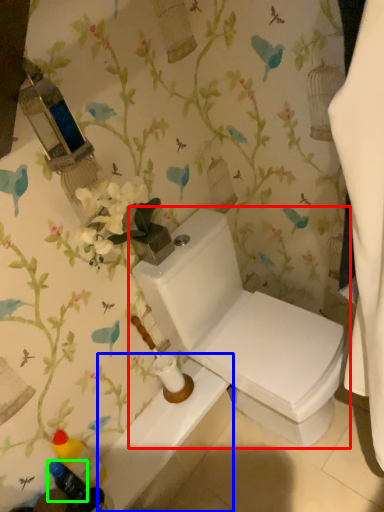
Question: Which object is positioned closest to toilet (highlighted by a red box)? Select from bath (highlighted by a blue box) and toiletry (highlighted by a green box).

Choices:
 (A) bath
 (B) toiletry

Answer: (A)